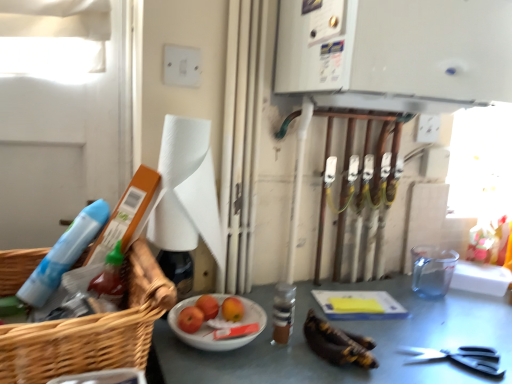
Question: Does shiny red apples at center, which ranks as the first fruit in front-to-back order, appear on the left side of smooth red apple at center, which is counted as the first fruit, starting from the back?

Choices:
 (A) no
 (B) yes

Answer: (B)

Question: From a real-world perspective, is shiny red apples at center, which is counted as the 2th fruit, starting from the back, positioned over smooth red apple at center, placed as the second fruit when sorted from front to back, based on gravity?

Choices:
 (A) no
 (B) yes

Answer: (A)

Question: Can you confirm if shiny red apples at center, which is counted as the 2th fruit, starting from the back, is positioned to the right of smooth red apple at center, which is counted as the first fruit, starting from the back?

Choices:
 (A) no
 (B) yes

Answer: (A)

Question: From the image's perspective, is shiny red apples at center, which is counted as the 2th fruit, starting from the back, on top of smooth red apple at center, which is counted as the first fruit, starting from the back?

Choices:
 (A) yes
 (B) no

Answer: (B)

Question: Is shiny red apples at center, which ranks as the first fruit in front-to-back order, thinner than smooth red apple at center, placed as the second fruit when sorted from front to back?

Choices:
 (A) yes
 (B) no

Answer: (A)

Question: Is brown glass bottle at center bigger or smaller than smooth red apple at center, placed as the second fruit when sorted from front to back?

Choices:
 (A) big
 (B) small

Answer: (A)

Question: Do you think brown glass bottle at center is within smooth red apple at center, which is counted as the first fruit, starting from the back, or outside of it?

Choices:
 (A) outside
 (B) inside

Answer: (A)

Question: In terms of height, does brown glass bottle at center look taller or shorter compared to smooth red apple at center, which is counted as the first fruit, starting from the back?

Choices:
 (A) short
 (B) tall

Answer: (B)

Question: In the image, is brown glass bottle at center positioned in front of or behind smooth red apple at center, which is counted as the first fruit, starting from the back?

Choices:
 (A) behind
 (B) front

Answer: (B)

Question: In terms of size, does metallic gray table at center appear bigger or smaller than shiny red apples at center, which is counted as the 2th fruit, starting from the back?

Choices:
 (A) small
 (B) big

Answer: (B)

Question: Is metallic gray table at center situated inside shiny red apples at center, which ranks as the first fruit in front-to-back order, or outside?

Choices:
 (A) outside
 (B) inside

Answer: (A)

Question: Is metallic gray table at center in front of or behind shiny red apples at center, which ranks as the first fruit in front-to-back order, in the image?

Choices:
 (A) behind
 (B) front

Answer: (B)

Question: From a real-world perspective, is metallic gray table at center positioned above or below shiny red apples at center, which ranks as the first fruit in front-to-back order?

Choices:
 (A) below
 (B) above

Answer: (A)

Question: Would you say white paper towel at center is to the left or to the right of smooth red apple at center, which is counted as the first fruit, starting from the back, in the picture?

Choices:
 (A) left
 (B) right

Answer: (A)

Question: Is white paper towel at center taller or shorter than smooth red apple at center, placed as the second fruit when sorted from front to back?

Choices:
 (A) tall
 (B) short

Answer: (A)